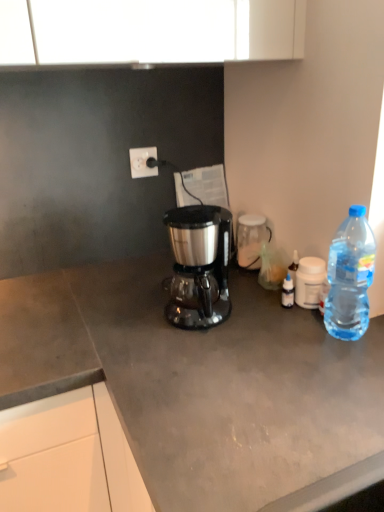
Question: Is clear plastic bottle at right looking in the opposite direction of transparent plastic coffee cup at right, the second coffee cup positioned from the back?

Choices:
 (A) no
 (B) yes

Answer: (A)

Question: Is clear plastic bottle at right beside transparent plastic coffee cup at right, arranged as the second coffee cup when viewed from the left?

Choices:
 (A) yes
 (B) no

Answer: (B)

Question: Considering the relative positions of clear plastic bottle at right and transparent plastic coffee cup at right, arranged as the second coffee cup when viewed from the left, in the image provided, is clear plastic bottle at right in front of transparent plastic coffee cup at right, arranged as the second coffee cup when viewed from the left,?

Choices:
 (A) yes
 (B) no

Answer: (A)

Question: Is clear plastic bottle at right shorter than transparent plastic coffee cup at right, the second coffee cup positioned from the back?

Choices:
 (A) no
 (B) yes

Answer: (A)

Question: Is clear plastic bottle at right bigger than transparent plastic coffee cup at right, the 1th coffee cup positioned from the right?

Choices:
 (A) yes
 (B) no

Answer: (A)

Question: Can you confirm if clear plastic bottle at right is thinner than transparent plastic coffee cup at right, the first coffee cup positioned from the front?

Choices:
 (A) no
 (B) yes

Answer: (A)

Question: From a real-world perspective, is white plastic power outlet at upper center on top of satin black coffee maker at center?

Choices:
 (A) no
 (B) yes

Answer: (B)

Question: Is white plastic power outlet at upper center positioned with its back to satin black coffee maker at center?

Choices:
 (A) yes
 (B) no

Answer: (B)

Question: Is white plastic power outlet at upper center to the right of satin black coffee maker at center from the viewer's perspective?

Choices:
 (A) yes
 (B) no

Answer: (B)

Question: From a real-world perspective, is white plastic power outlet at upper center positioned under satin black coffee maker at center based on gravity?

Choices:
 (A) yes
 (B) no

Answer: (B)

Question: From the image's perspective, is white plastic power outlet at upper center below satin black coffee maker at center?

Choices:
 (A) yes
 (B) no

Answer: (B)

Question: Are white plastic power outlet at upper center and satin black coffee maker at center located far from each other?

Choices:
 (A) yes
 (B) no

Answer: (B)

Question: From a real-world perspective, does satin black coffee maker at center sit lower than clear plastic bottle at right?

Choices:
 (A) no
 (B) yes

Answer: (B)